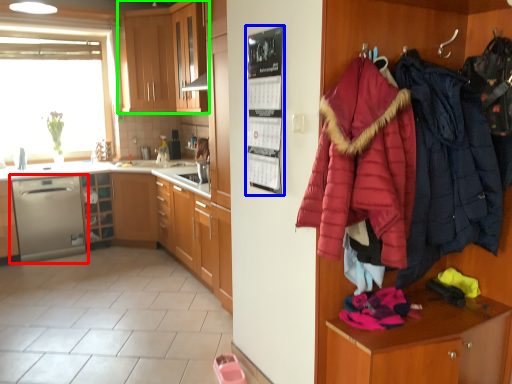
Question: Which is farther away from dishwasher (highlighted by a red box)? bulletin board (highlighted by a blue box) or cabinetry (highlighted by a green box)?

Choices:
 (A) bulletin board
 (B) cabinetry

Answer: (A)